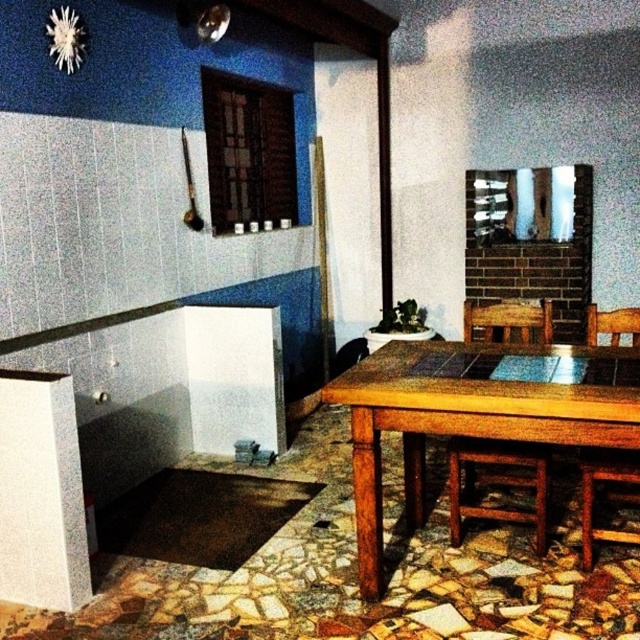
Question: Does wooden table at center have a lesser width compared to wooden chair at lower right?

Choices:
 (A) yes
 (B) no

Answer: (B)

Question: Which point appears farthest from the camera in this image?

Choices:
 (A) (548, 336)
 (B) (596, 435)

Answer: (A)

Question: Is wooden table at center below wooden chair at center?

Choices:
 (A) no
 (B) yes

Answer: (A)

Question: Which point is farther to the camera?

Choices:
 (A) (552, 394)
 (B) (592, 532)
 (C) (452, 461)

Answer: (C)

Question: Can you confirm if wooden table at center is smaller than wooden chair at center?

Choices:
 (A) yes
 (B) no

Answer: (B)

Question: Estimate the real-world distances between objects in this image. Which object is closer to the wooden table at center?

Choices:
 (A) wooden chair at lower right
 (B) wooden chair at center

Answer: (B)